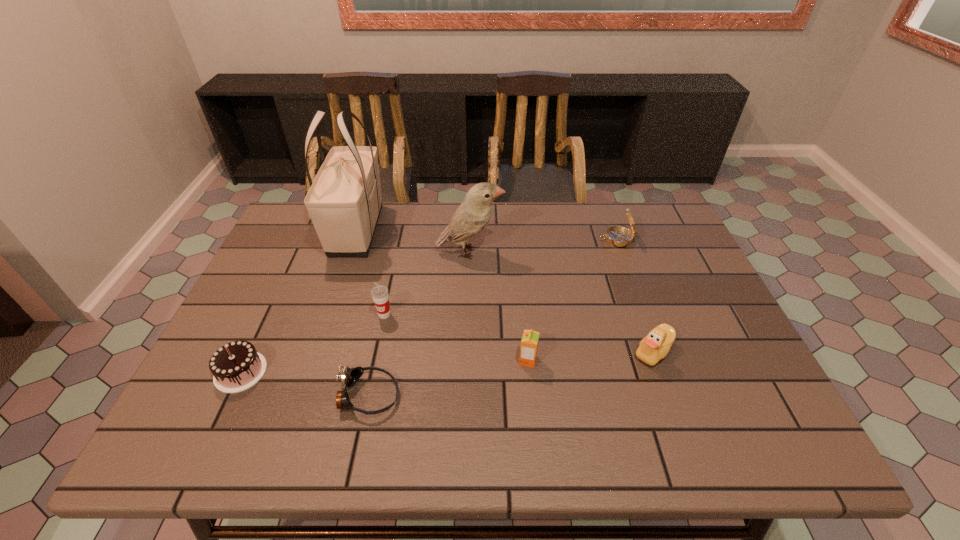
This screenshot has width=960, height=540. Find the location of `unoccupied position between the fourth farthest object and the duck`. unoccupied position between the fourth farthest object and the duck is located at coordinates (518, 333).

Where is `vacant area that lies between the orange juice and the fourth farthest object`? This screenshot has height=540, width=960. vacant area that lies between the orange juice and the fourth farthest object is located at coordinates (456, 338).

You are a GUI agent. You are given a task and a screenshot of the screen. Output one action in this format:
    pyautogui.click(x=<x>, y=<y>)
    Task: Click on the free area in between the shortest object and the shopping bag
    The width and height of the screenshot is (960, 540).
    Given the screenshot: What is the action you would take?
    363,313

Locate an element on the screen. Image resolution: width=960 pixels, height=540 pixels. vacant area that lies between the shortest object and the compass is located at coordinates (492, 318).

Image resolution: width=960 pixels, height=540 pixels. Identify the location of unoccupied area between the compass and the shortest object. (492, 318).

I want to click on empty space that is in between the shopping bag and the shortest object, so click(x=363, y=313).

You are a GUI agent. You are given a task and a screenshot of the screen. Output one action in this format:
    pyautogui.click(x=<x>, y=<y>)
    Task: Click on the free space between the duck and the shortest object
    
    Given the screenshot: What is the action you would take?
    pyautogui.click(x=511, y=374)

Find the location of a particular element. Image resolution: width=960 pixels, height=540 pixels. object that is the closest to the cup is located at coordinates (349, 376).

Find the location of a particular element. Image resolution: width=960 pixels, height=540 pixels. object that is the third closest to the bird is located at coordinates (618, 236).

Find the location of a particular element. free space that satisfies the following two spatial constraints: 1. at the face of the fifth object from left to right; 2. on the front side of the leftmost object is located at coordinates (467, 372).